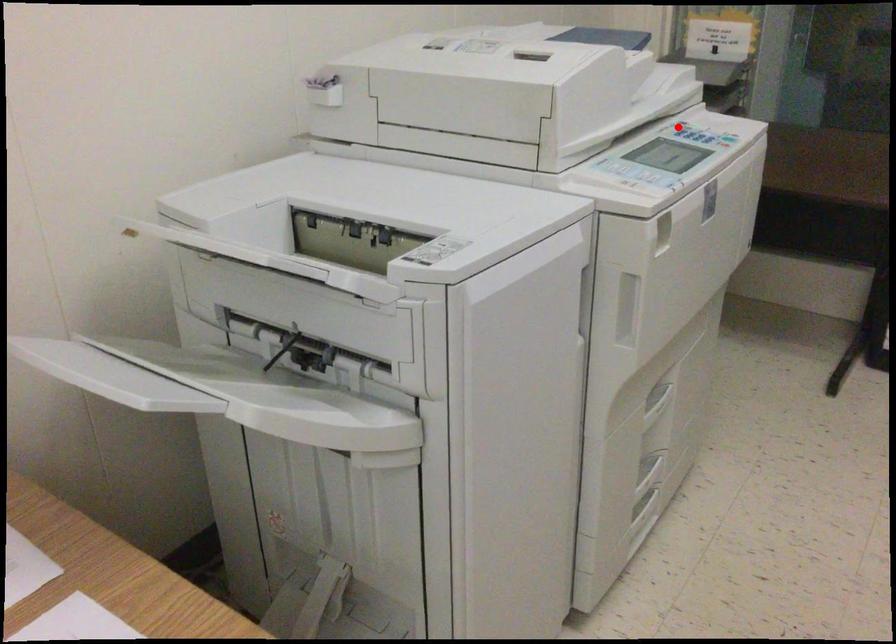
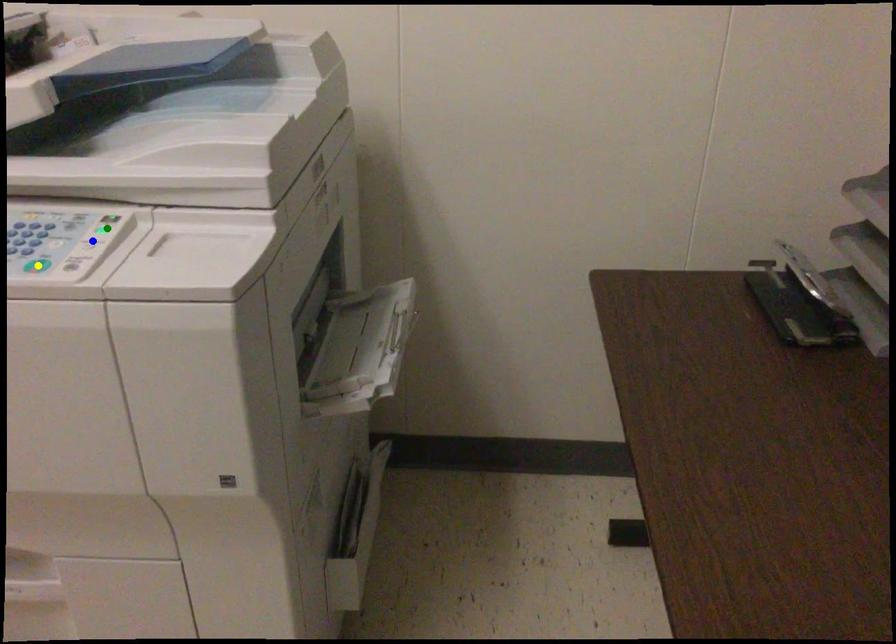
Question: I am providing you with two images of the same scene from different viewpoints. A red point is marked on the first image. You are given multiple points on the second image. Which mark in image 2 goes with the point in image 1?

Choices:
 (A) blue point
 (B) green point
 (C) yellow point

Answer: (B)